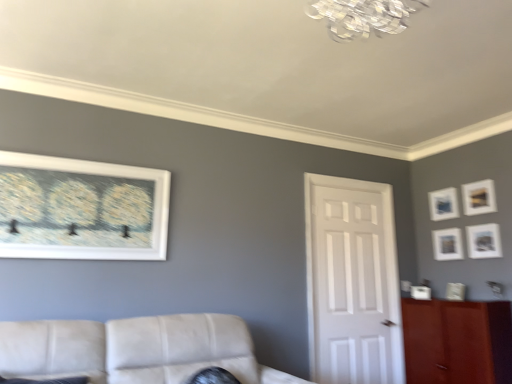
Question: From a real-world perspective, is matte white picture frame at right, placed as the 1th picture frame when sorted from right to left, positioned above or below white glossy door at center?

Choices:
 (A) above
 (B) below

Answer: (A)

Question: Looking at the image, does matte white picture frame at right, the second picture frame viewed from the front, seem bigger or smaller compared to white glossy door at center?

Choices:
 (A) big
 (B) small

Answer: (B)

Question: Considering the real-world distances, which object is farthest from the brown wood cabinet at right?

Choices:
 (A) leather couch at lower left
 (B) matte white picture frame at right, placed as the 1th picture frame when sorted from right to left
 (C) white matte picture frame at upper left, the first picture frame viewed from the front
 (D) matte gold picture frame at upper right, which is the 5th picture frame in left-to-right order
 (E) matte blue picture frame at upper right, the sixth picture frame viewed from the front

Answer: (C)

Question: Estimate the real-world distances between objects in this image. Which object is farther from the brown wood cabinet at right?

Choices:
 (A) matte white picture frame at right, positioned as the sixth picture frame in left-to-right order
 (B) white matte picture frame at right, placed as the 2th picture frame when sorted from left to right
 (C) leather couch at lower left
 (D) matte white picture frame at upper right, marked as the 2th picture frame in a back-to-front arrangement
 (E) matte gold picture frame at upper right, positioned as the 2th picture frame in right-to-left order

Answer: (C)